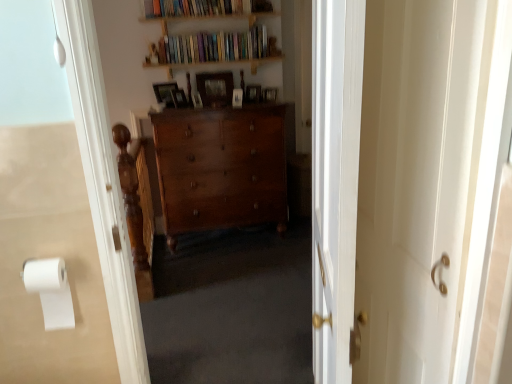
Locate an element on the screen. The height and width of the screenshot is (384, 512). vacant space in polished wood dresser at center (from a real-world perspective) is located at coordinates (217, 244).